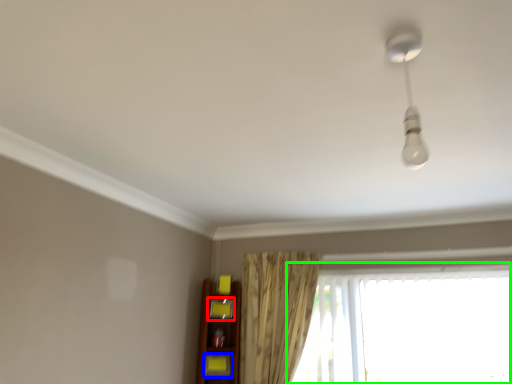
Question: Which object is positioned closest to shelf (highlighted by a red box)? Select from shelf (highlighted by a blue box) and window (highlighted by a green box).

Choices:
 (A) shelf
 (B) window

Answer: (A)